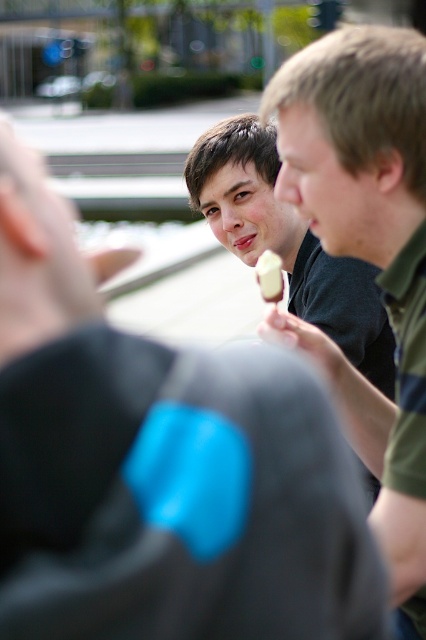
You are a photographer trying to capture a photo of the matte green shirt at center and the matte plastic ice cream at center. Which object should you zoom in on to make them appear larger in your photo?

The matte plastic ice cream at center is thicker than the matte green shirt at center, so you should zoom in on the matte plastic ice cream at center to make it appear larger in the photo.